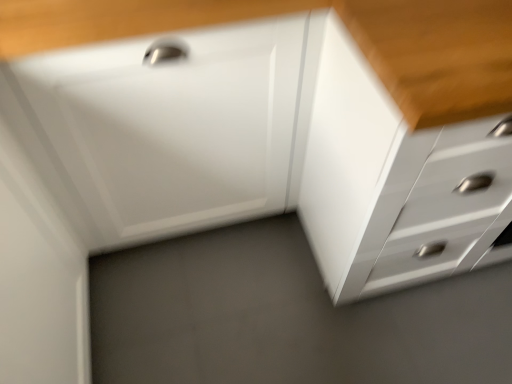
This screenshot has height=384, width=512. Find the location of `white glossy drawer at center`. white glossy drawer at center is located at coordinates (162, 130).

Describe the element at coordinates (162, 130) in the screenshot. This screenshot has width=512, height=384. I see `white glossy drawer at center` at that location.

Where is `white glossy chest of drawers at center`? This screenshot has width=512, height=384. white glossy chest of drawers at center is located at coordinates (392, 179).

This screenshot has width=512, height=384. What do you see at coordinates (392, 179) in the screenshot?
I see `white glossy chest of drawers at center` at bounding box center [392, 179].

I want to click on white glossy drawer at center, so click(162, 130).

Considering the relative positions of white glossy chest of drawers at center and white glossy drawer at center in the image provided, is white glossy chest of drawers at center to the right of white glossy drawer at center from the viewer's perspective?

Yes.

Considering the relative positions of white glossy chest of drawers at center and white glossy drawer at center in the image provided, is white glossy chest of drawers at center behind white glossy drawer at center?

No, the depth of white glossy chest of drawers at center is less than that of white glossy drawer at center.

Considering the positions of points (426, 261) and (226, 50), is point (426, 261) farther from camera compared to point (226, 50)?

Yes, point (426, 261) is farther from viewer.

From the image's perspective, which one is positioned higher, white glossy chest of drawers at center or white glossy drawer at center?

white glossy drawer at center is shown above in the image.

From a real-world perspective, between white glossy chest of drawers at center and white glossy drawer at center, who is vertically lower?

white glossy drawer at center is physically lower.

Is white glossy chest of drawers at center thinner than white glossy drawer at center?

No, white glossy chest of drawers at center is not thinner than white glossy drawer at center.

Considering the sizes of white glossy chest of drawers at center and white glossy drawer at center in the image, is white glossy chest of drawers at center taller or shorter than white glossy drawer at center?

Considering their sizes, white glossy chest of drawers at center has more height than white glossy drawer at center.

Is white glossy chest of drawers at center smaller than white glossy drawer at center?

No.

Is white glossy chest of drawers at center not inside white glossy drawer at center?

Yes, white glossy chest of drawers at center is located beyond the bounds of white glossy drawer at center.

Is white glossy chest of drawers at center not close to white glossy drawer at center?

No.

Could you tell me if white glossy chest of drawers at center is turned towards white glossy drawer at center?

No, white glossy chest of drawers at center is not facing towards white glossy drawer at center.

How many degrees apart are the facing directions of white glossy chest of drawers at center and white glossy drawer at center?

They differ by 0.257 degrees in their facing directions.

Find the location of `drawer on the left side of white glossy chest of drawers at center`. drawer on the left side of white glossy chest of drawers at center is located at coordinates (162, 130).

Looking at this image, does white glossy drawer at center appear on the right side of white glossy chest of drawers at center?

Incorrect, white glossy drawer at center is not on the right side of white glossy chest of drawers at center.

Is the depth of white glossy drawer at center greater than that of white glossy chest of drawers at center?

Yes, it is behind white glossy chest of drawers at center.

Which point is more distant from viewer, (x=27, y=94) or (x=431, y=190)?

Point (x=431, y=190)

From the image's perspective, which is below, white glossy drawer at center or white glossy chest of drawers at center?

white glossy chest of drawers at center is shown below in the image.

From a real-world perspective, which is physically above, white glossy drawer at center or white glossy chest of drawers at center?

white glossy chest of drawers at center, from a real-world perspective.

Which object is wider, white glossy drawer at center or white glossy chest of drawers at center?

With larger width is white glossy chest of drawers at center.

Can you confirm if white glossy drawer at center is taller than white glossy chest of drawers at center?

No, white glossy drawer at center is not taller than white glossy chest of drawers at center.

Who is smaller, white glossy drawer at center or white glossy chest of drawers at center?

white glossy drawer at center is smaller.

Can white glossy chest of drawers at center be found inside white glossy drawer at center?

No, white glossy chest of drawers at center is located outside of white glossy drawer at center.

Is white glossy drawer at center far from white glossy chest of drawers at center?

No, white glossy drawer at center is not far away from white glossy chest of drawers at center.

Is white glossy drawer at center turned away from white glossy chest of drawers at center?

No, white glossy drawer at center is not facing away from white glossy chest of drawers at center.

Measure the distance between white glossy drawer at center and white glossy chest of drawers at center.

white glossy drawer at center and white glossy chest of drawers at center are 13.88 inches apart from each other.

Locate an element on the screen. drawer above the white glossy chest of drawers at center (from the image's perspective) is located at coordinates tap(162, 130).

You are a GUI agent. You are given a task and a screenshot of the screen. Output one action in this format:
    pyautogui.click(x=<x>, y=<y>)
    Task: Click on the chest of drawers that appears above the white glossy drawer at center (from a real-world perspective)
    Image resolution: width=512 pixels, height=384 pixels.
    Given the screenshot: What is the action you would take?
    pyautogui.click(x=392, y=179)

At what (x,y) coordinates should I click in order to perform the action: click on drawer that is above the white glossy chest of drawers at center (from the image's perspective). Please return your answer as a coordinate pair (x, y). The width and height of the screenshot is (512, 384). Looking at the image, I should click on (162, 130).